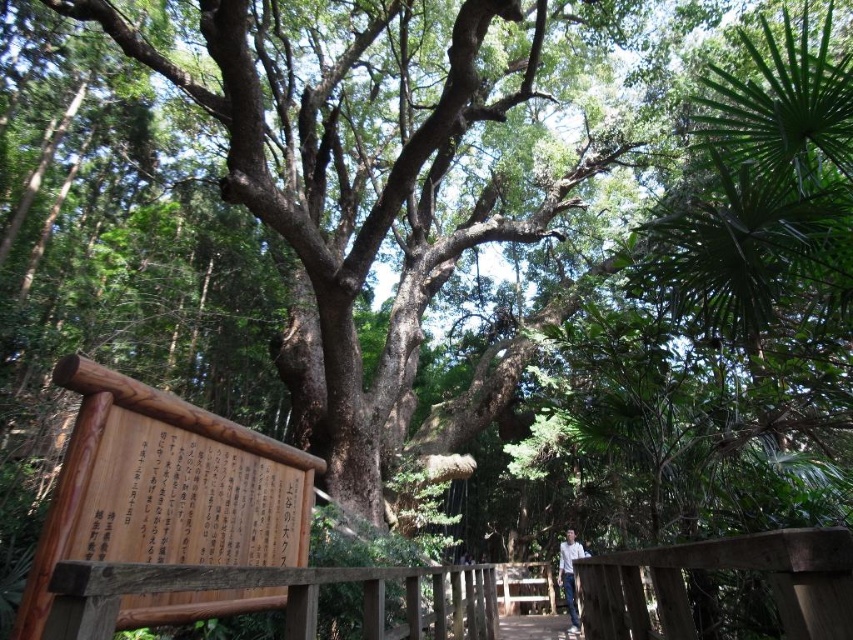
Question: Can you confirm if brown wooden rail at lower center is positioned to the right of white shirt at center?

Choices:
 (A) yes
 (B) no

Answer: (B)

Question: Which object appears closest to the camera in this image?

Choices:
 (A) white shirt at center
 (B) brown wooden rail at lower center
 (C) wooden bridge at center

Answer: (B)

Question: Which of these objects is positioned farthest from the white shirt at center?

Choices:
 (A) wooden bridge at center
 (B) brown wooden rail at lower center

Answer: (B)

Question: Where is wooden bridge at center located in relation to white shirt at center in the image?

Choices:
 (A) above
 (B) below

Answer: (B)

Question: Which point is closer to the camera taking this photo?

Choices:
 (A) (572, 627)
 (B) (561, 620)
 (C) (439, 621)

Answer: (C)

Question: Does brown wooden rail at lower center have a greater width compared to white shirt at center?

Choices:
 (A) no
 (B) yes

Answer: (A)